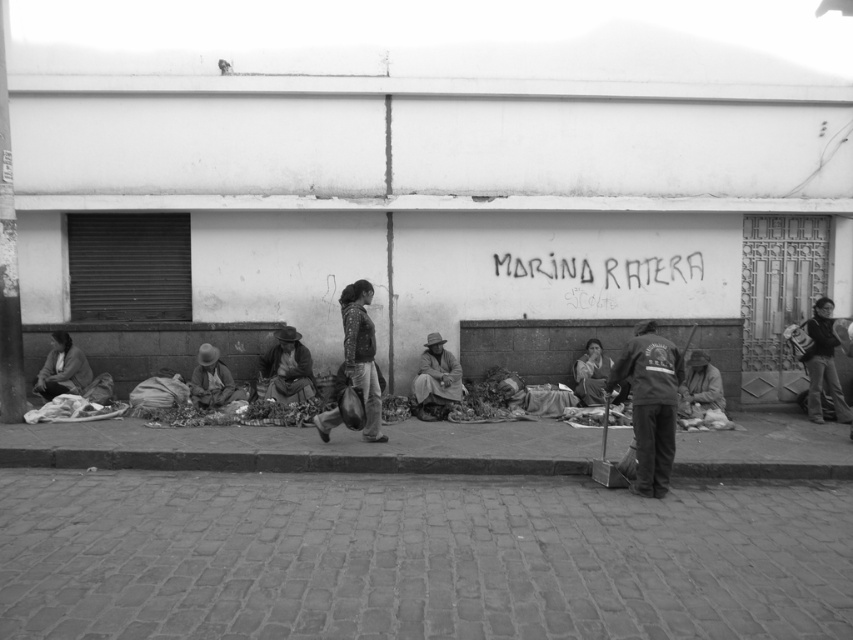
You are a pedestrian walking along the street in the scene. You notice two items of clothing in the image. The dark gray fabric jacket at center and the matte brown hat at lower left. Which clothing item is positioned lower in the image?

The dark gray fabric jacket at center is located below the matte brown hat at lower left, so the jacket is positioned lower in the image.

You are a pedestrian walking along the curb and see the matte brown jacket at lower left and the dark gray fabric at lower right. Which item is covering the other?

The matte brown jacket at lower left is positioned over dark gray fabric at lower right, so the matte brown jacket is covering the dark gray fabric.